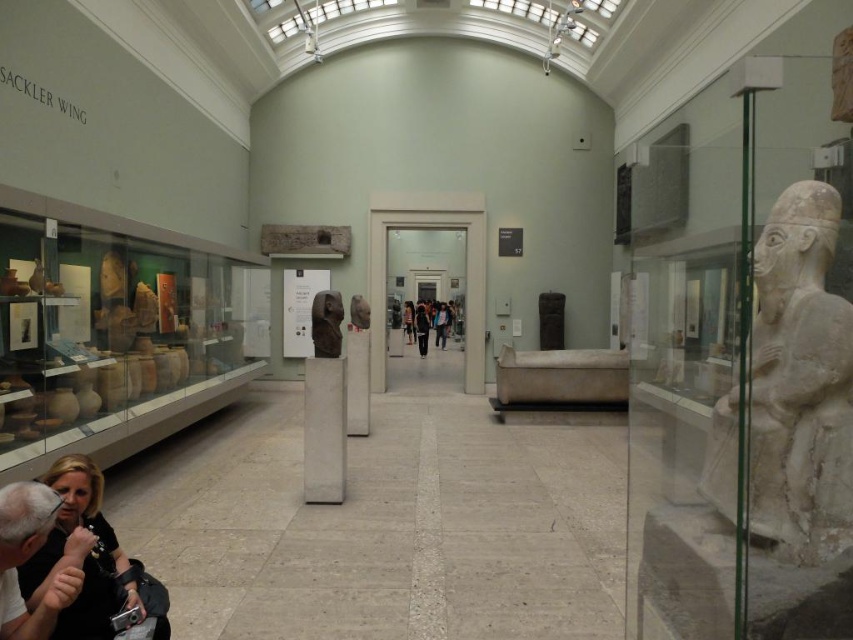
Question: Which of these objects is positioned closest to the matte black hair at lower left?

Choices:
 (A) white marble pillar at center
 (B) white marble statue at right

Answer: (B)

Question: Is white marble statue at right to the right of matte stone bust at center from the viewer's perspective?

Choices:
 (A) no
 (B) yes

Answer: (B)

Question: Which object is the closest to the white textured shirt at lower left?

Choices:
 (A) matte stone bust at center
 (B) white marble pillar at center
 (C) matte stone statue at center
 (D) matte black hair at lower left

Answer: (D)

Question: Is matte black hair at lower left smaller than white textured shirt at lower left?

Choices:
 (A) no
 (B) yes

Answer: (A)

Question: Does white textured shirt at lower left appear on the right side of light brown leather jacket at center?

Choices:
 (A) yes
 (B) no

Answer: (B)

Question: Estimate the real-world distances between objects in this image. Which object is farther from the matte stone statue at center?

Choices:
 (A) light brown leather jacket at center
 (B) matte black hair at lower left
 (C) white textured shirt at lower left

Answer: (A)